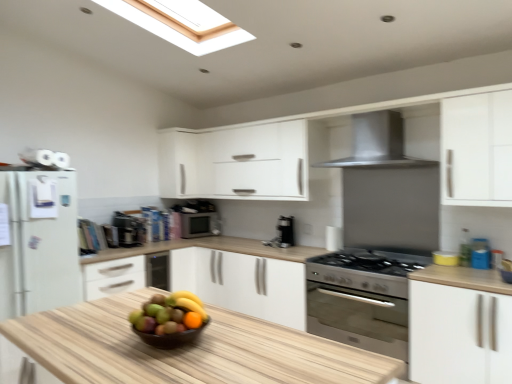
The height and width of the screenshot is (384, 512). Find the location of `free point above white matte cabinet at right, the first cabinetry viewed from the right (from a real-world perspective)`. free point above white matte cabinet at right, the first cabinetry viewed from the right (from a real-world perspective) is located at coordinates (460, 271).